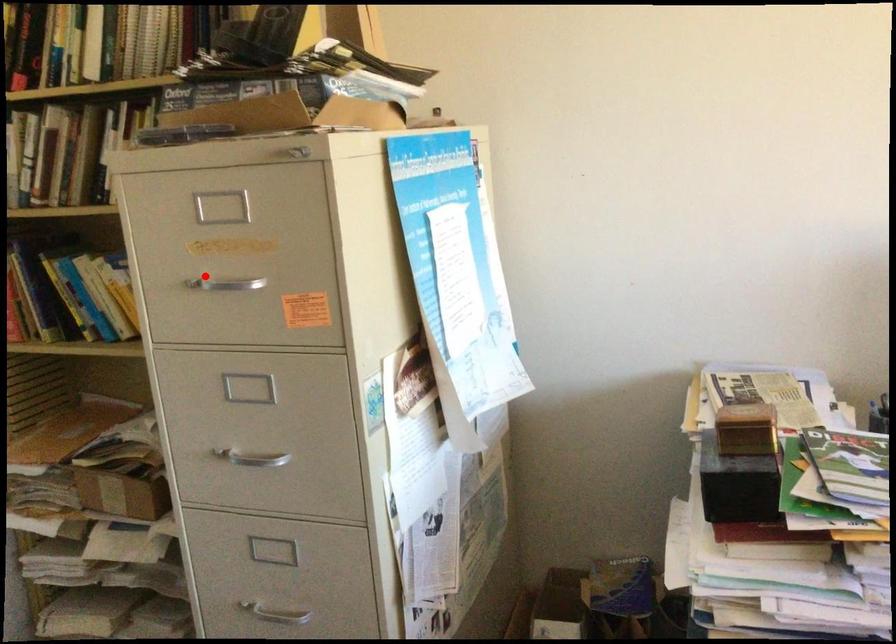
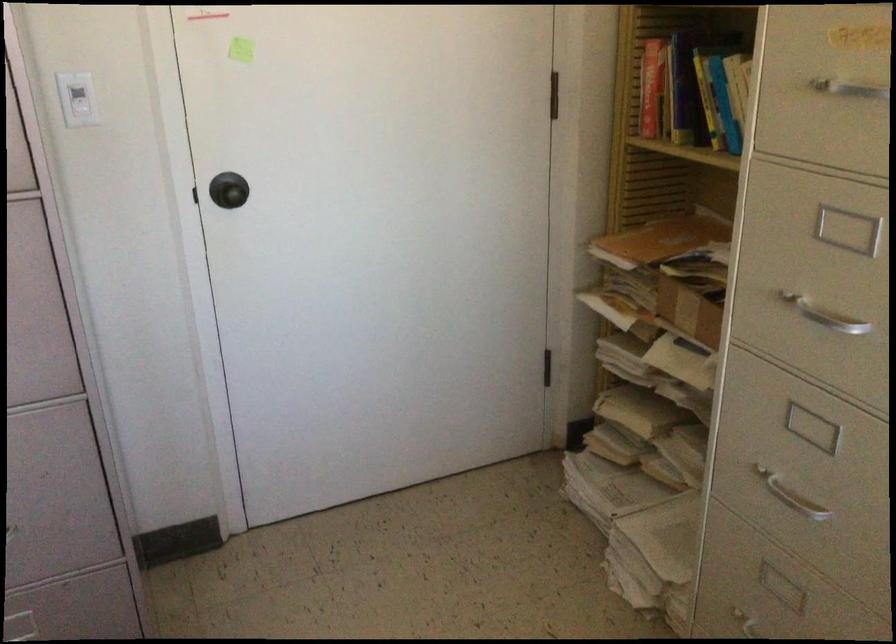
Question: I am providing you with two images of the same scene from different viewpoints. In image1, a red point is highlighted. Considering the same 3D point in image2, which of the following is correct?

Choices:
 (A) It is closer
 (B) It is farther

Answer: (A)